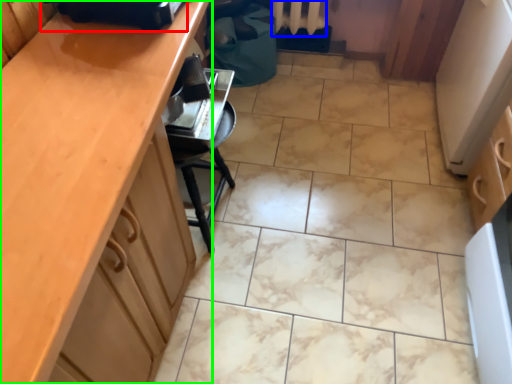
Question: Which object is the closest to the appliance (highlighted by a red box)? Choose among these: radiator (highlighted by a blue box) or cabinetry (highlighted by a green box).

Choices:
 (A) radiator
 (B) cabinetry

Answer: (B)